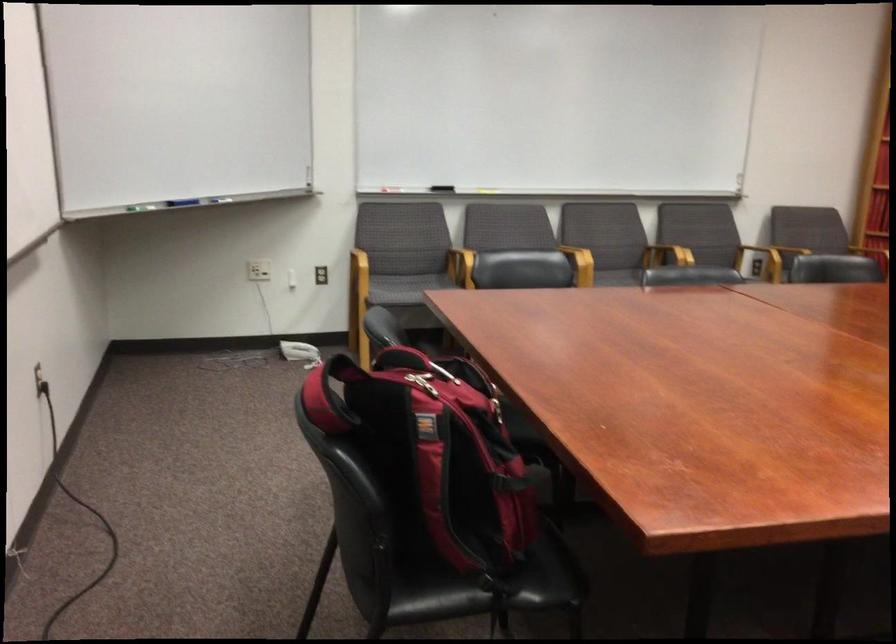
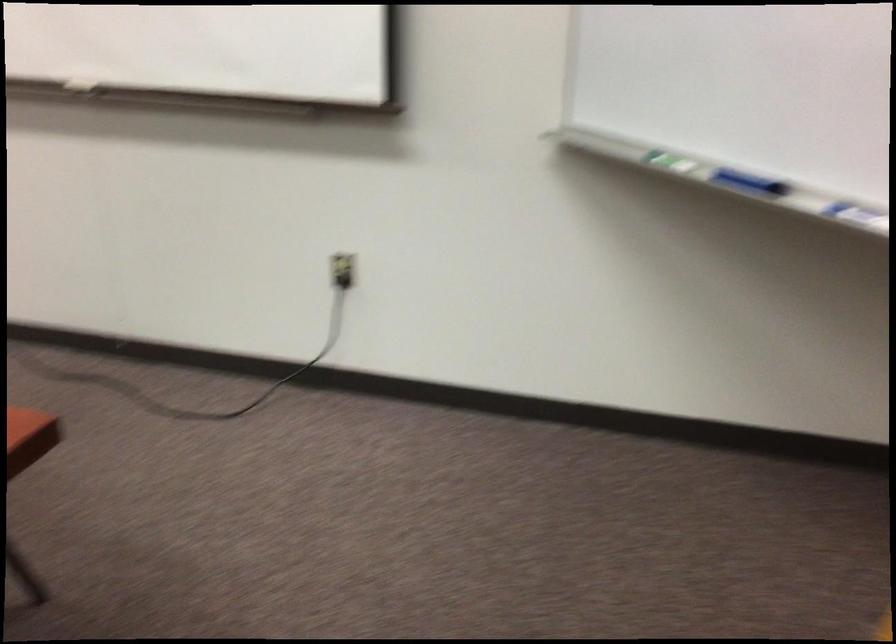
In the second image, find the point that corresponds to point 154,167 in the first image.

(748, 182)